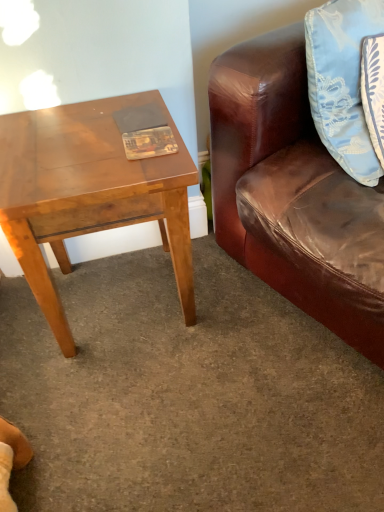
Find the location of `light blue satin pillow at upper right`. light blue satin pillow at upper right is located at coordinates (342, 81).

Where is `light blue satin pillow at upper right`? The width and height of the screenshot is (384, 512). light blue satin pillow at upper right is located at coordinates (342, 81).

Can you confirm if matte plastic book at center is smaller than light blue satin pillow at upper right?

Indeed, matte plastic book at center has a smaller size compared to light blue satin pillow at upper right.

Is matte plastic book at center oriented away from light blue satin pillow at upper right?

No, light blue satin pillow at upper right is not at the back of matte plastic book at center.

Does matte plastic book at center touch light blue satin pillow at upper right?

No, matte plastic book at center is not making contact with light blue satin pillow at upper right.

Is matte plastic book at center taller than light blue satin pillow at upper right?

In fact, matte plastic book at center may be shorter than light blue satin pillow at upper right.

Between light brown wooden table at left and matte plastic book at center, which one has more height?

light brown wooden table at left is taller.

Which object is positioned more to the right, light brown wooden table at left or matte plastic book at center?

matte plastic book at center is more to the right.

Can we say light brown wooden table at left lies outside matte plastic book at center?

Absolutely, light brown wooden table at left is external to matte plastic book at center.

Between point (16, 163) and point (150, 139), which one is positioned behind?

Point (150, 139)

Find the location of `book behind the light brown wooden table at left`. book behind the light brown wooden table at left is located at coordinates (149, 143).

From the image's perspective, is matte plastic book at center positioned above or below light brown wooden table at left?

Based on their image positions, matte plastic book at center is located above light brown wooden table at left.

Is matte plastic book at center facing away from light brown wooden table at left?

Yes, matte plastic book at center's orientation is away from light brown wooden table at left.

Considering the positions of objects light blue satin pillow at upper right and light brown wooden table at left in the image provided, who is behind, light blue satin pillow at upper right or light brown wooden table at left?

light brown wooden table at left is further away from the camera.

From the image's perspective, is light blue satin pillow at upper right below light brown wooden table at left?

No.

Is light brown wooden table at left at the back of light blue satin pillow at upper right?

light blue satin pillow at upper right does not have its back to light brown wooden table at left.

Can you tell me how much light blue satin pillow at upper right and light brown wooden table at left differ in facing direction?

26.7 degrees.

Consider the image. Considering the relative positions of light brown wooden table at left and light blue satin pillow at upper right in the image provided, is light brown wooden table at left to the left or to the right of light blue satin pillow at upper right?

Clearly, light brown wooden table at left is on the left of light blue satin pillow at upper right in the image.

Can we say light brown wooden table at left lies outside light blue satin pillow at upper right?

That's correct, light brown wooden table at left is outside of light blue satin pillow at upper right.

From the image's perspective, does light brown wooden table at left appear higher than light blue satin pillow at upper right?

Actually, light brown wooden table at left appears below light blue satin pillow at upper right in the image.

This screenshot has width=384, height=512. Find the location of `coffee table beneath the light blue satin pillow at upper right (from a real-world perspective)`. coffee table beneath the light blue satin pillow at upper right (from a real-world perspective) is located at coordinates (88, 193).

Measure the distance from light blue satin pillow at upper right to matte plastic book at center.

light blue satin pillow at upper right is 15.09 inches away from matte plastic book at center.

From a real-world perspective, does light blue satin pillow at upper right sit lower than matte plastic book at center?

Yes.

Can you confirm if light blue satin pillow at upper right is wider than matte plastic book at center?

Yes.

Based on the photo, between light blue satin pillow at upper right and matte plastic book at center, which one has less height?

Standing shorter between the two is matte plastic book at center.

You are a GUI agent. You are given a task and a screenshot of the screen. Output one action in this format:
    pyautogui.click(x=<x>, y=<y>)
    Task: Click on the pillow that appears below the matte plastic book at center (from a real-world perspective)
    This screenshot has height=512, width=384.
    Given the screenshot: What is the action you would take?
    point(342,81)

Locate an element on the screen. The height and width of the screenshot is (512, 384). book behind the light brown wooden table at left is located at coordinates (149, 143).

Which object lies further to the anchor point light brown wooden table at left, matte plastic book at center or light blue satin pillow at upper right?

light blue satin pillow at upper right lies further to light brown wooden table at left than the other object.

Which object lies nearer to the anchor point light brown wooden table at left, light blue satin pillow at upper right or matte plastic book at center?

matte plastic book at center.

When comparing their distances from light blue satin pillow at upper right, does light brown wooden table at left or matte plastic book at center seem closer?

matte plastic book at center is closer to light blue satin pillow at upper right.

Based on their spatial positions, is light blue satin pillow at upper right or light brown wooden table at left further from matte plastic book at center?

Among the two, light blue satin pillow at upper right is located further to matte plastic book at center.

Considering their positions, is light brown wooden table at left positioned closer to matte plastic book at center than light blue satin pillow at upper right?

light brown wooden table at left lies closer to matte plastic book at center than the other object.

From the image, which object appears to be farther from light blue satin pillow at upper right, matte plastic book at center or light brown wooden table at left?

light brown wooden table at left is positioned further to the anchor light blue satin pillow at upper right.

Image resolution: width=384 pixels, height=512 pixels. Find the location of `book between light brown wooden table at left and light blue satin pillow at upper right`. book between light brown wooden table at left and light blue satin pillow at upper right is located at coordinates click(149, 143).